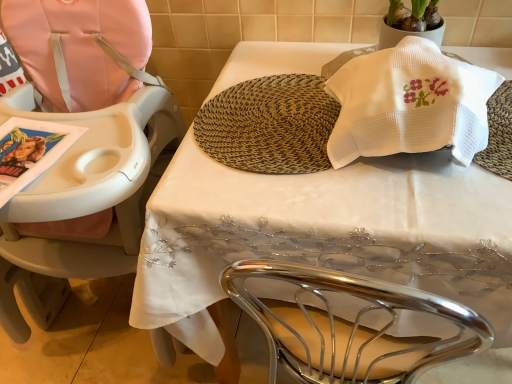
Question: Is white waffle-textured towel at upper right inside or outside of brown woven mat at center?

Choices:
 (A) outside
 (B) inside

Answer: (A)

Question: Is point pos(437,69) positioned closer to the camera than point pos(298,104)?

Choices:
 (A) farther
 (B) closer

Answer: (B)

Question: Based on their relative distances, which object is nearer to the white embroidered tablecloth at center?

Choices:
 (A) brown woven mat at center
 (B) pink fabric highchair at left
 (C) white waffle-textured towel at upper right

Answer: (A)

Question: Estimate the real-world distances between objects in this image. Which object is closer to the white embroidered tablecloth at center?

Choices:
 (A) brown woven mat at center
 (B) pink fabric highchair at left
 (C) white waffle-textured towel at upper right

Answer: (A)